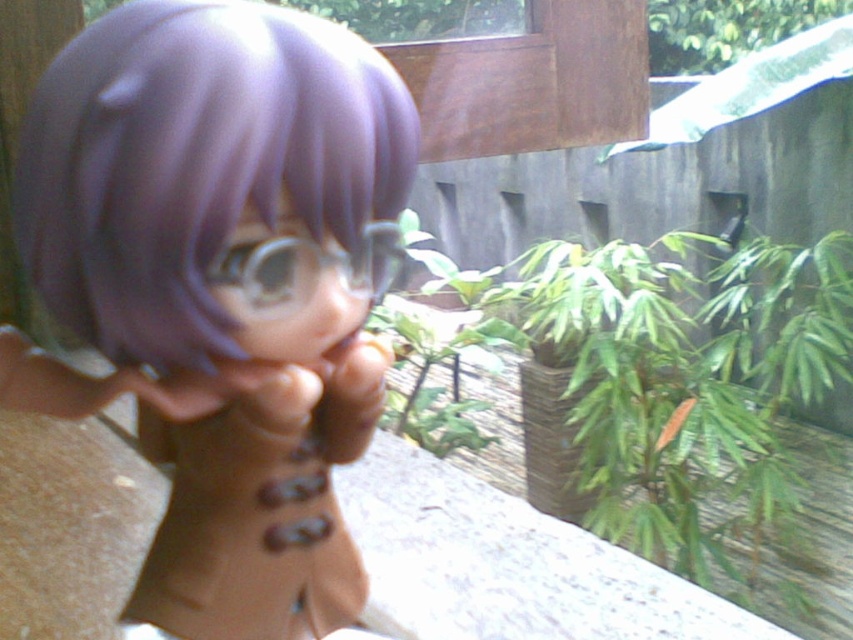
Question: Which of these objects is positioned farthest from the green leafy plant at upper right?

Choices:
 (A) matte purple doll at center
 (B) green leafy plant at center

Answer: (A)

Question: Is matte purple doll at center bigger than green leafy plant at center?

Choices:
 (A) yes
 (B) no

Answer: (B)

Question: Which object is positioned farthest from the green leafy plant at center?

Choices:
 (A) green leafy plant at upper right
 (B) matte purple doll at center

Answer: (A)

Question: Is matte purple doll at center to the left of green leafy plant at upper right from the viewer's perspective?

Choices:
 (A) no
 (B) yes

Answer: (B)

Question: Which point is farther from the camera taking this photo?

Choices:
 (A) (48, 404)
 (B) (741, 458)

Answer: (B)

Question: Is the position of matte purple doll at center less distant than that of green leafy plant at upper right?

Choices:
 (A) no
 (B) yes

Answer: (B)